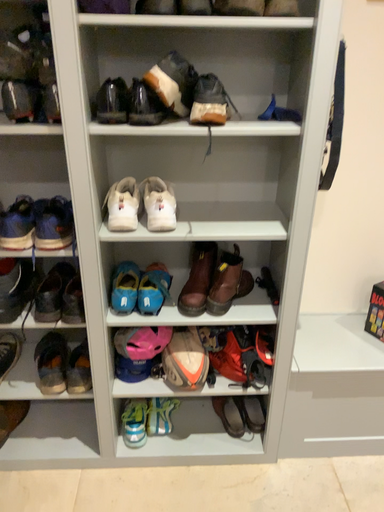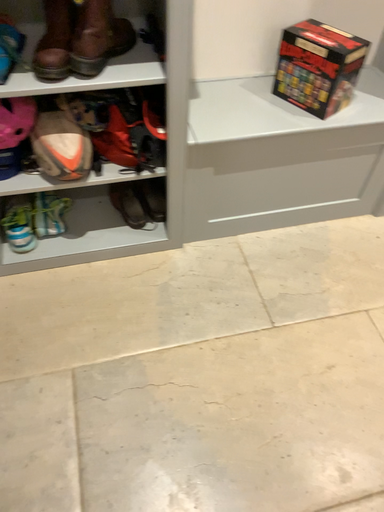
Question: How did the camera likely rotate when shooting the video?

Choices:
 (A) rotated right
 (B) rotated left

Answer: (A)